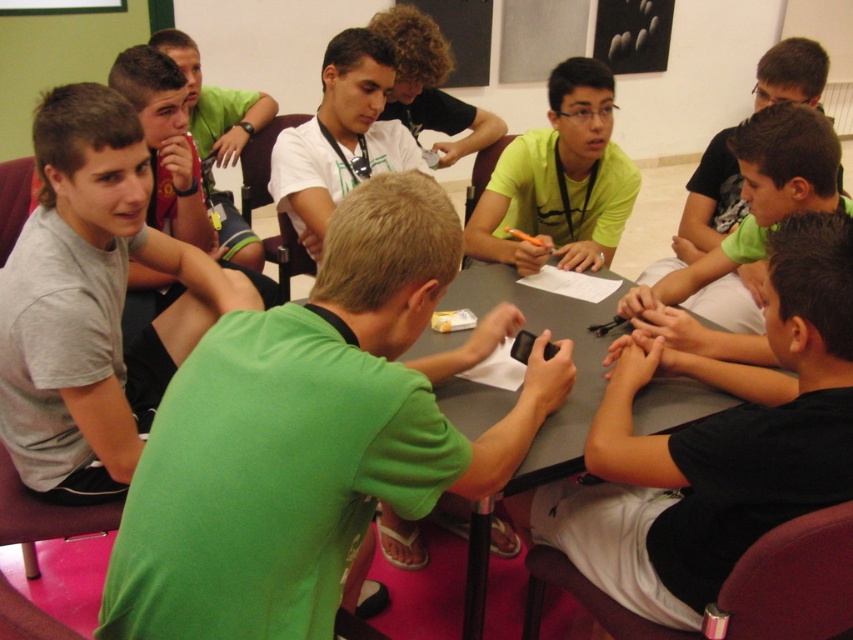
Based on the scene described, which participant is positioned lower in the image, the gray cotton shirt at left or the matte green shirt at upper left?

The gray cotton shirt at left is positioned below the matte green shirt at upper left in the image.

You are a photographer standing behind the participants at the table. You need to take a photo of the green matte shirt at center and the black matte shirt at upper right. Which shirt should you adjust to be closer to the camera to ensure both are in focus?

The green matte shirt at center should be moved closer to the camera because it is already positioned to the left of the black matte shirt at upper right, so moving it forward will help both shirts be in focus.

You are standing at the point labeled as point (312, 435) in the image. Which object is directly in front of you?

The point (312, 435) corresponds to the green matte shirt at center, so the green matte shirt at center is directly in front of you.